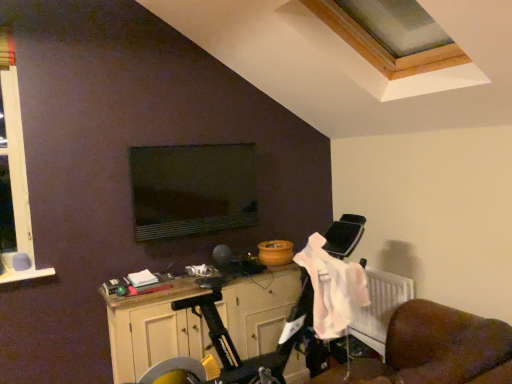
Question: Is the depth of pink fabric at lower right greater than that of matte black monitor at center?

Choices:
 (A) yes
 (B) no

Answer: (B)

Question: Is pink fabric at lower right positioned in front of matte black monitor at center?

Choices:
 (A) yes
 (B) no

Answer: (A)

Question: Is pink fabric at lower right at the left side of matte black monitor at center?

Choices:
 (A) yes
 (B) no

Answer: (B)

Question: From the image's perspective, is pink fabric at lower right on top of matte black monitor at center?

Choices:
 (A) no
 (B) yes

Answer: (A)

Question: Is pink fabric at lower right turned away from matte black monitor at center?

Choices:
 (A) yes
 (B) no

Answer: (B)

Question: Does pink fabric at lower right appear on the right side of matte black monitor at center?

Choices:
 (A) yes
 (B) no

Answer: (A)

Question: Considering the relative positions of wooden cabinet at lower center and pink fabric at lower right in the image provided, is wooden cabinet at lower center to the left of pink fabric at lower right from the viewer's perspective?

Choices:
 (A) yes
 (B) no

Answer: (A)

Question: Is wooden cabinet at lower center positioned with its back to pink fabric at lower right?

Choices:
 (A) no
 (B) yes

Answer: (A)

Question: Is wooden cabinet at lower center far from pink fabric at lower right?

Choices:
 (A) yes
 (B) no

Answer: (B)

Question: From a real-world perspective, is wooden cabinet at lower center below pink fabric at lower right?

Choices:
 (A) no
 (B) yes

Answer: (B)

Question: Is wooden cabinet at lower center positioned in front of pink fabric at lower right?

Choices:
 (A) yes
 (B) no

Answer: (B)

Question: From a real-world perspective, is wooden cabinet at lower center on pink fabric at lower right?

Choices:
 (A) no
 (B) yes

Answer: (A)

Question: From the image's perspective, is wooden cabinet at lower center on matte black monitor at center?

Choices:
 (A) yes
 (B) no

Answer: (B)